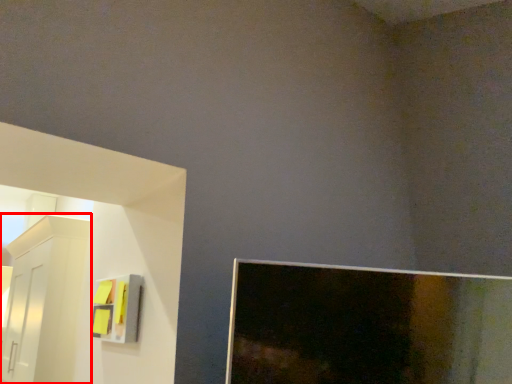
Question: From the image's perspective, where is furniture (annotated by the red box) located relative to cabinet?

Choices:
 (A) below
 (B) above

Answer: (A)